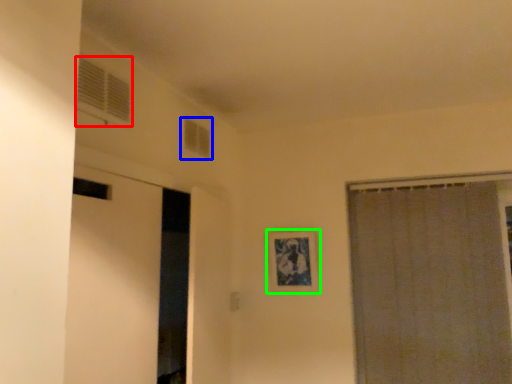
Question: Which is farther away from window (highlighted by a red box)? window (highlighted by a blue box) or picture frame (highlighted by a green box)?

Choices:
 (A) window
 (B) picture frame

Answer: (B)